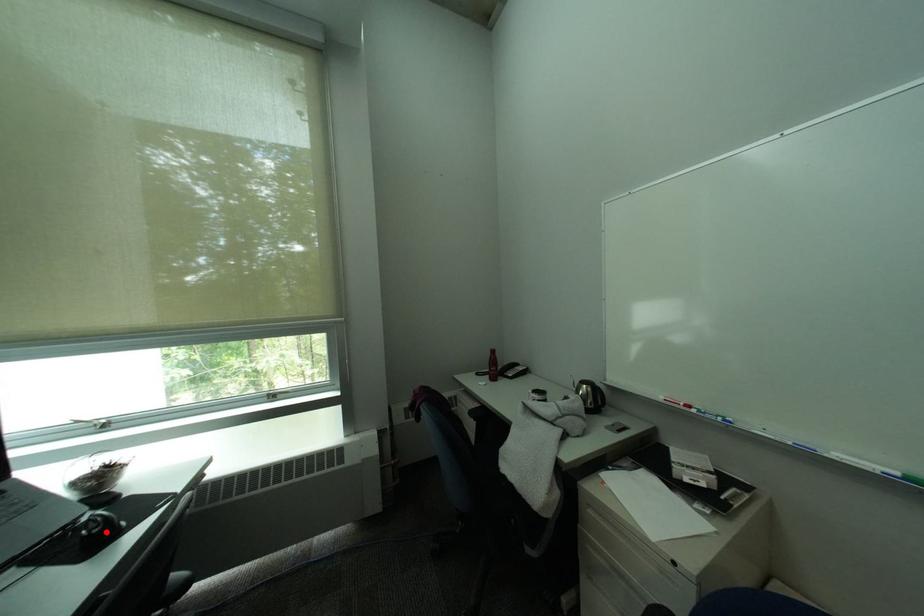
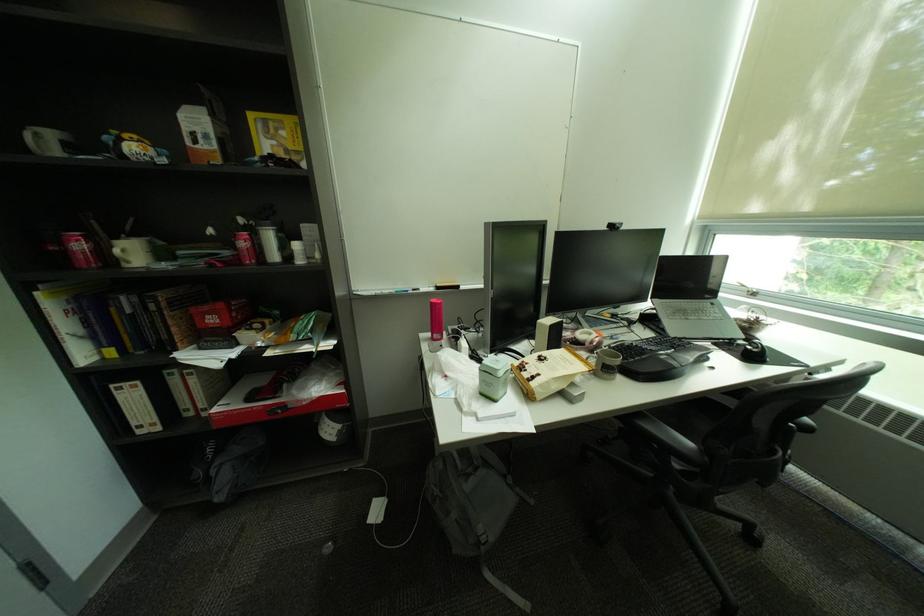
The point at the highlighted location is marked in the first image. Where is the corresponding point in the second image?

(766, 352)